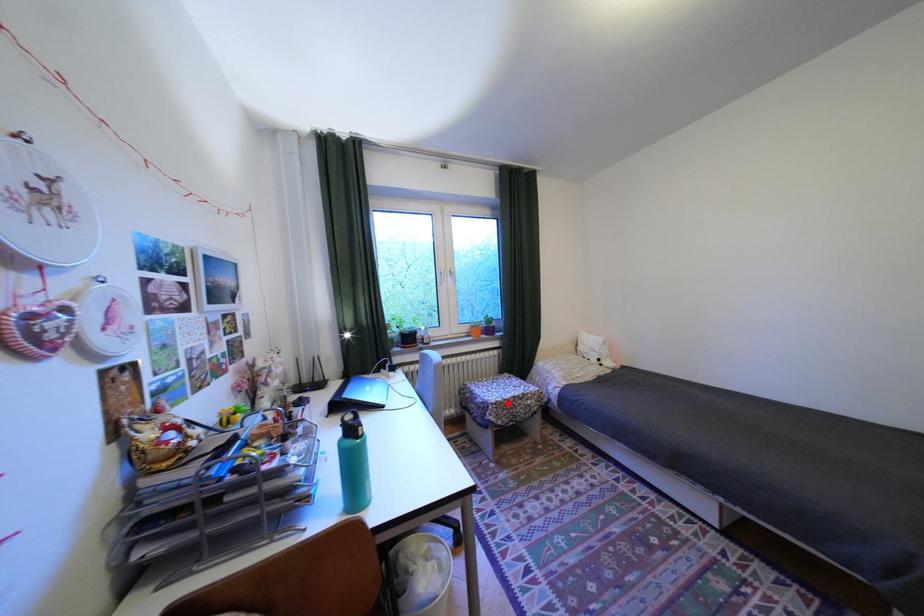
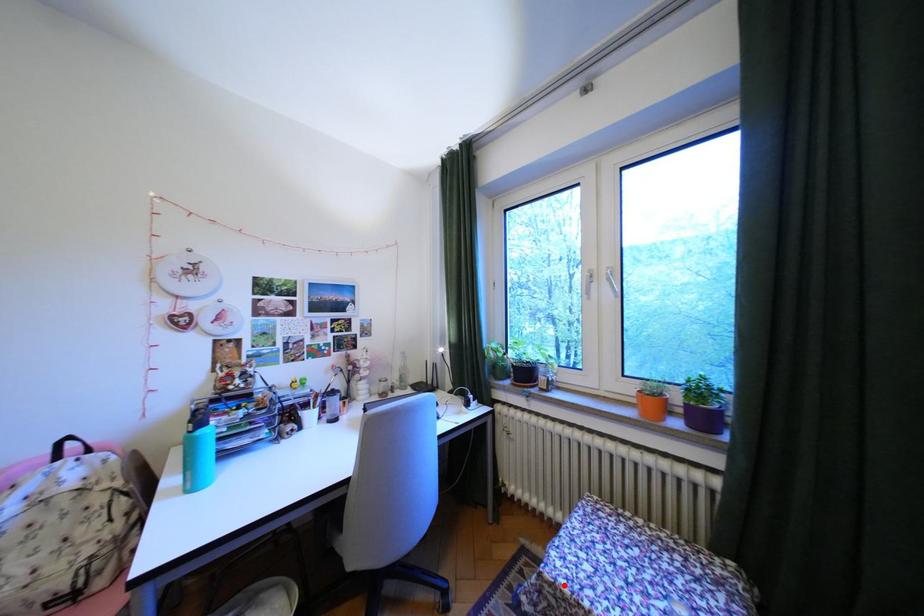
I am providing you with two images of the same scene from different viewpoints. A red point is marked on the first image and another point is marked on the second image. Does the point marked in image1 correspond to the same location as the one in image2?

Yes